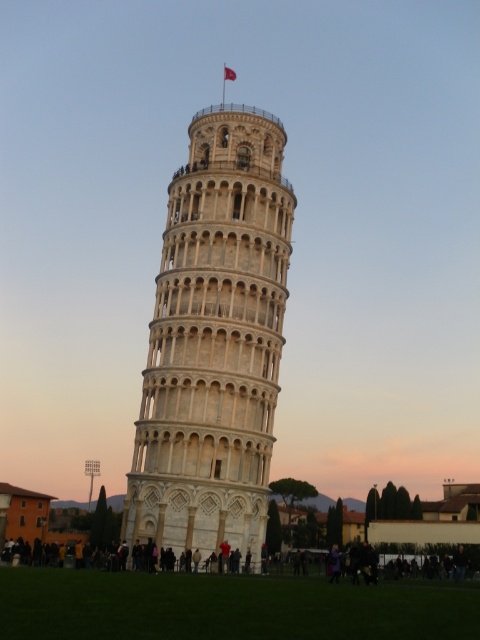
Which is behind, point (272, 250) or point (235, 74)?

Positioned behind is point (235, 74).

Is white stone tower at center closer to the viewer compared to red fabric flag at upper center?

Yes, white stone tower at center is in front of red fabric flag at upper center.

Which is in front, point (295, 198) or point (233, 70)?

Positioned in front is point (295, 198).

I want to click on white stone tower at center, so click(x=215, y=340).

Between point (432, 547) and point (233, 77), which one is positioned behind?

The point (233, 77) is more distant.

Is dark gray concrete people at lower center smaller than red fabric flag at upper center?

No.

Which is behind, point (452, 573) or point (228, 67)?

The point (228, 67) is more distant.

You are a GUI agent. You are given a task and a screenshot of the screen. Output one action in this format:
    pyautogui.click(x=<x>, y=<y>)
    Task: Click on the dark gray concrete people at lower center
    
    Given the screenshot: What is the action you would take?
    coord(429,563)

Between white stone tower at center and dark gray concrete people at lower center, which one is positioned higher?

white stone tower at center is above.

What do you see at coordinates (215, 340) in the screenshot? The image size is (480, 640). I see `white stone tower at center` at bounding box center [215, 340].

What are the coordinates of `white stone tower at center` in the screenshot? It's located at (215, 340).